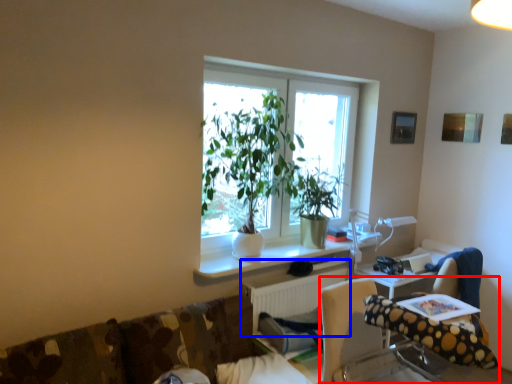
Question: Among these objects, which one is farthest to the camera, chair (highlighted by a red box) or radiator (highlighted by a blue box)?

Choices:
 (A) chair
 (B) radiator

Answer: (B)